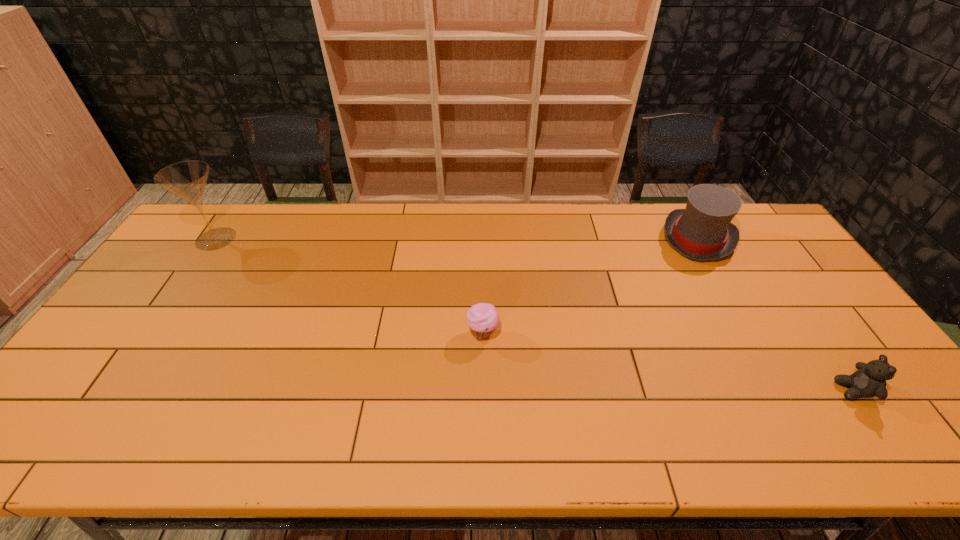
Find the location of a particular element. This screenshot has height=540, width=960. object located in the far right corner section of the desktop is located at coordinates (703, 231).

The height and width of the screenshot is (540, 960). What are the coordinates of `free spot at the far edge of the desktop` in the screenshot? It's located at coord(641,238).

Locate an element on the screen. The image size is (960, 540). vacant space at the near edge of the desktop is located at coordinates (280, 421).

Find the location of a particular element. free region at the left edge of the desktop is located at coordinates (82, 391).

Locate an element on the screen. This screenshot has height=540, width=960. vacant area at the right edge is located at coordinates (833, 351).

Where is `vacant space at the near left corner of the desktop`? Image resolution: width=960 pixels, height=540 pixels. vacant space at the near left corner of the desktop is located at coordinates (65, 434).

Find the location of `free point between the rightmost object and the tallest object`. free point between the rightmost object and the tallest object is located at coordinates (535, 314).

This screenshot has height=540, width=960. I want to click on blank region between the third object from right to left and the second object from right to left, so click(590, 286).

The height and width of the screenshot is (540, 960). I want to click on free area in between the third object from right to left and the second tallest object, so click(590, 286).

Where is `unoccupied area between the flute glass and the cupcake`? The height and width of the screenshot is (540, 960). unoccupied area between the flute glass and the cupcake is located at coordinates (349, 286).